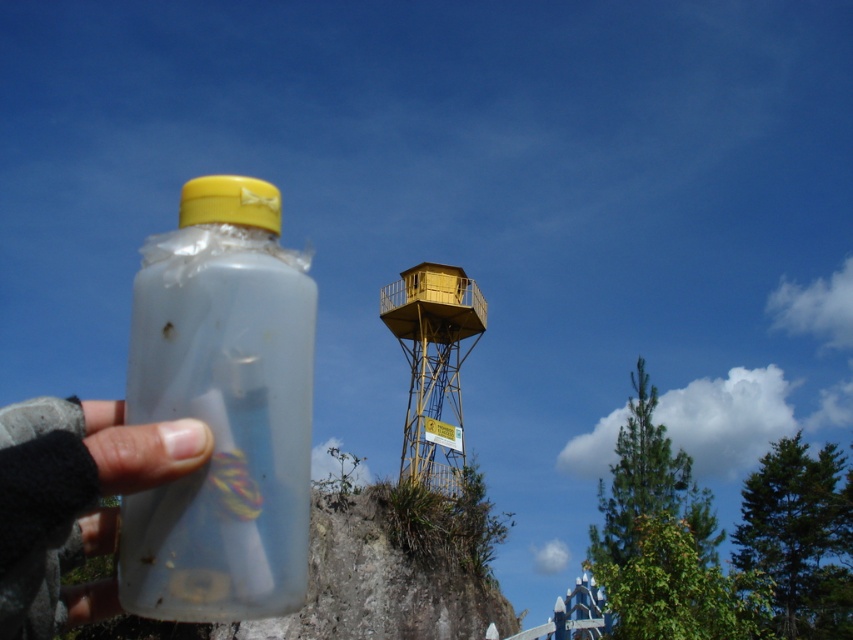
Question: Considering the real-world distances, which object is farthest from the yellow matte water tower at center?

Choices:
 (A) transparent plastic bottle at lower left
 (B) transparent plastic bottle at center

Answer: (A)

Question: Can you confirm if transparent plastic bottle at center is positioned above yellow matte water tower at center?

Choices:
 (A) no
 (B) yes

Answer: (B)

Question: Which object is farther from the camera taking this photo?

Choices:
 (A) transparent plastic bottle at lower left
 (B) yellow matte water tower at center
 (C) transparent plastic bottle at center

Answer: (B)

Question: Considering the relative positions of transparent plastic bottle at lower left and yellow matte water tower at center in the image provided, where is transparent plastic bottle at lower left located with respect to yellow matte water tower at center?

Choices:
 (A) below
 (B) above

Answer: (B)

Question: Which of these objects is positioned farthest from the transparent plastic bottle at lower left?

Choices:
 (A) transparent plastic bottle at center
 (B) yellow matte water tower at center

Answer: (B)

Question: Is transparent plastic bottle at center closer to camera compared to yellow matte water tower at center?

Choices:
 (A) no
 (B) yes

Answer: (B)